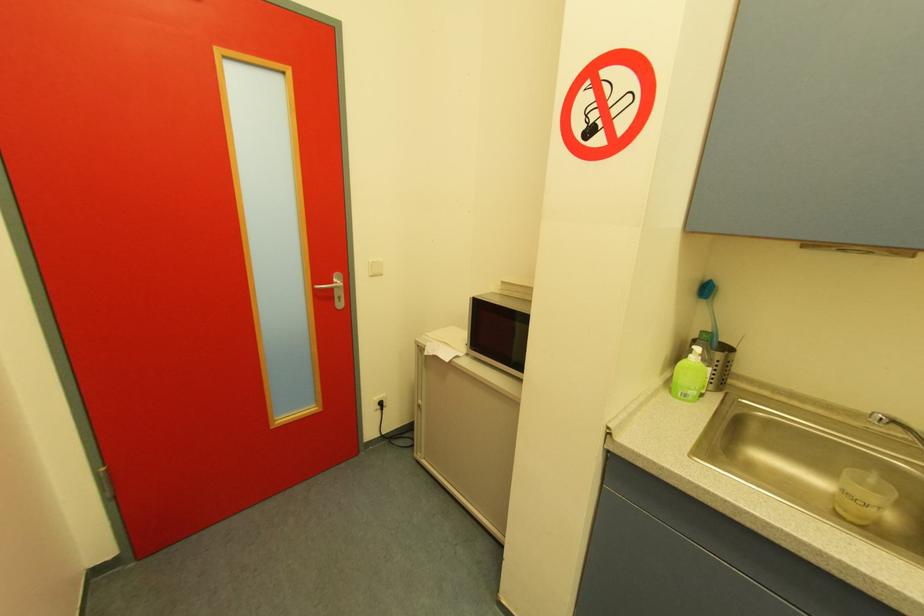
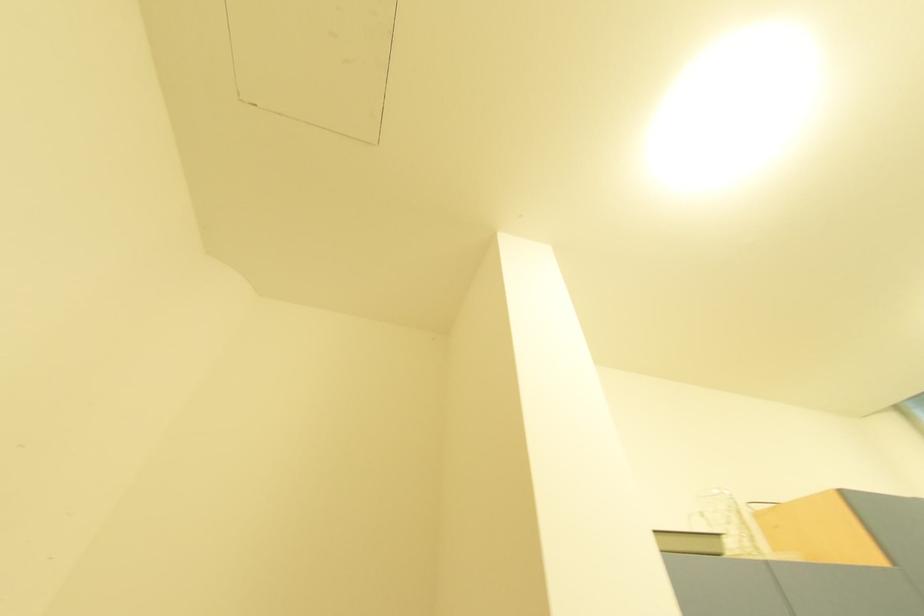
How did the camera likely rotate?

The rotation direction of the camera is right-up.